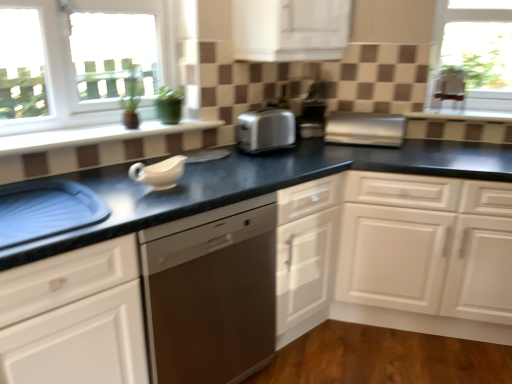
Question: Is white matte cabinet at center, positioned as the first cabinetry in bottom-to-top order, thinner than white glossy cabinet at upper center, the second cabinetry ordered from the bottom?

Choices:
 (A) yes
 (B) no

Answer: (B)

Question: Does white matte cabinet at center, positioned as the first cabinetry in bottom-to-top order, turn towards white glossy cabinet at upper center, the second cabinetry ordered from the bottom?

Choices:
 (A) no
 (B) yes

Answer: (A)

Question: From a real-world perspective, is white matte cabinet at center, positioned as the first cabinetry in bottom-to-top order, located higher than white glossy cabinet at upper center, the second cabinetry ordered from the bottom?

Choices:
 (A) no
 (B) yes

Answer: (A)

Question: From the image's perspective, is white matte cabinet at center, which appears as the 2th cabinetry when viewed from the top, located beneath white glossy cabinet at upper center, the 1th cabinetry when ordered from top to bottom?

Choices:
 (A) yes
 (B) no

Answer: (A)

Question: Is the depth of white matte cabinet at center, which appears as the 2th cabinetry when viewed from the top, less than that of white glossy cabinet at upper center, the 1th cabinetry when ordered from top to bottom?

Choices:
 (A) no
 (B) yes

Answer: (A)

Question: Can you confirm if white matte cabinet at center, which appears as the 2th cabinetry when viewed from the top, is shorter than white glossy cabinet at upper center, the 1th cabinetry when ordered from top to bottom?

Choices:
 (A) no
 (B) yes

Answer: (A)

Question: Can you confirm if black granite countertop at center is positioned to the right of satin silver coffee machine at center?

Choices:
 (A) no
 (B) yes

Answer: (B)

Question: Does black granite countertop at center have a smaller size compared to satin silver coffee machine at center?

Choices:
 (A) yes
 (B) no

Answer: (B)

Question: Does black granite countertop at center have a greater height compared to satin silver coffee machine at center?

Choices:
 (A) yes
 (B) no

Answer: (A)

Question: Is black granite countertop at center not inside satin silver coffee machine at center?

Choices:
 (A) yes
 (B) no

Answer: (A)

Question: From the image's perspective, is black granite countertop at center on top of satin silver coffee machine at center?

Choices:
 (A) no
 (B) yes

Answer: (A)

Question: Is black granite countertop at center shorter than satin silver coffee machine at center?

Choices:
 (A) yes
 (B) no

Answer: (B)

Question: Considering the relative positions of white glossy cabinet at upper center, the second cabinetry ordered from the bottom, and blue plastic tray at lower left in the image provided, is white glossy cabinet at upper center, the second cabinetry ordered from the bottom, to the left of blue plastic tray at lower left from the viewer's perspective?

Choices:
 (A) no
 (B) yes

Answer: (A)